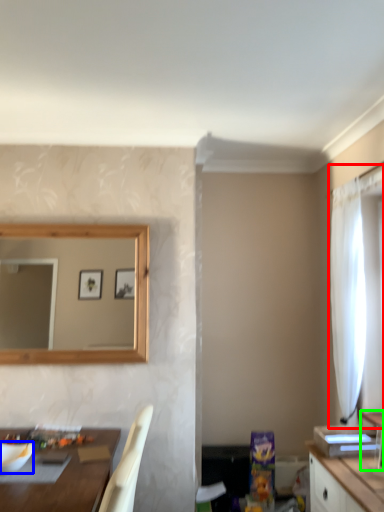
Question: Which is farther away from curtain (highlighted by a red box)? mixing bowl (highlighted by a blue box) or vanity (highlighted by a green box)?

Choices:
 (A) mixing bowl
 (B) vanity

Answer: (A)